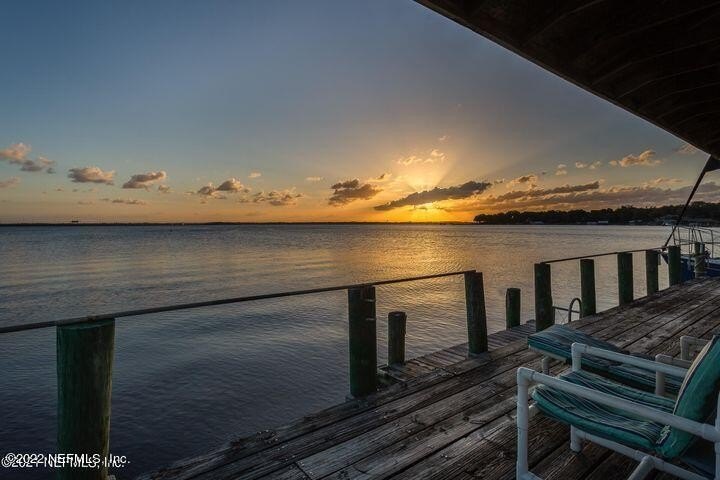
The height and width of the screenshot is (480, 720). I want to click on cushion, so click(690, 381), click(553, 337).